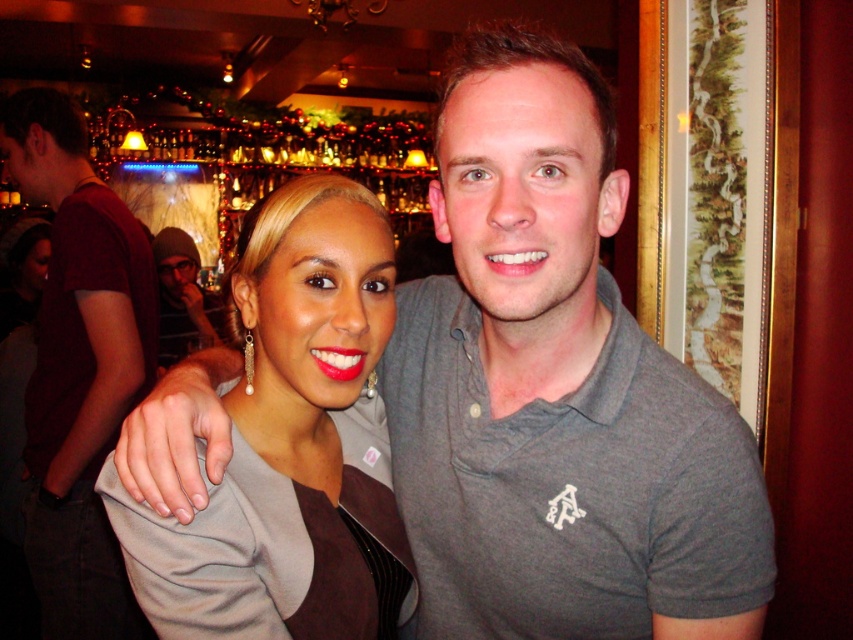
Question: Is matte gray blazer at center bigger than dark gray hoodie at upper left?

Choices:
 (A) yes
 (B) no

Answer: (B)

Question: Considering the real-world distances, which object is farthest from the matte gray blazer at center?

Choices:
 (A) dark gray hoodie at upper left
 (B) dark red t-shirt at left

Answer: (A)

Question: Among these objects, which one is farthest from the camera?

Choices:
 (A) dark red t-shirt at left
 (B) dark gray hoodie at upper left

Answer: (B)

Question: Is matte gray blazer at center below dark red t-shirt at left?

Choices:
 (A) yes
 (B) no

Answer: (B)

Question: Which point is closer to the camera?

Choices:
 (A) (39, 138)
 (B) (341, 177)
 (C) (190, 310)

Answer: (B)

Question: Can you confirm if matte gray blazer at center is wider than dark gray hoodie at upper left?

Choices:
 (A) yes
 (B) no

Answer: (B)